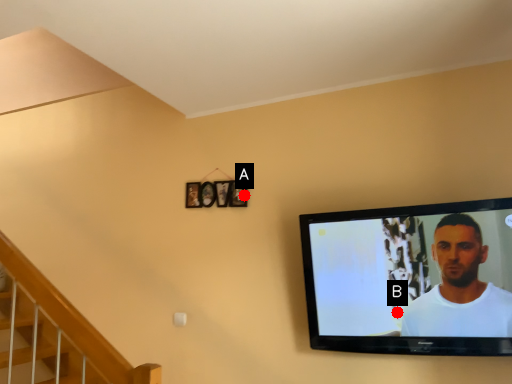
Question: Two points are circled on the image, labeled by A and B beside each circle. Which point is farther to the camera?

Choices:
 (A) A is further
 (B) B is further

Answer: (A)